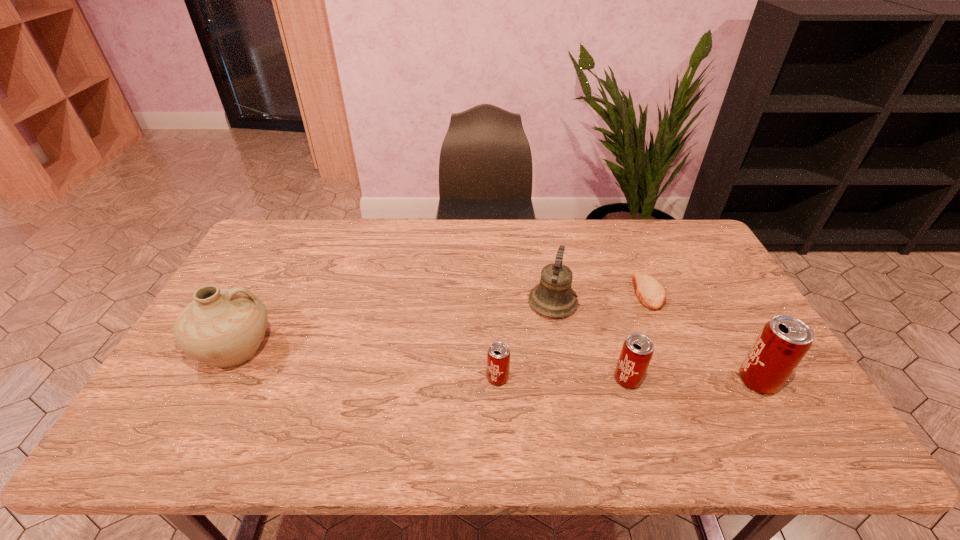
I want to click on free space located 0.060m on the left of the second object from left to right, so click(x=464, y=378).

The width and height of the screenshot is (960, 540). I want to click on free space located 0.330m on the back of the second beer can from right to left, so click(598, 284).

At what (x,y) coordinates should I click in order to perform the action: click on free point located on the left of the rightmost object. Please return your answer as a coordinate pair (x, y). This screenshot has width=960, height=540. Looking at the image, I should click on (708, 381).

Where is `vacant space situated on the back of the leftmost object`? vacant space situated on the back of the leftmost object is located at coordinates (283, 259).

At what (x,y) coordinates should I click in order to perform the action: click on blank space located on the back of the pita bread. Please return your answer as a coordinate pair (x, y). Image resolution: width=960 pixels, height=540 pixels. Looking at the image, I should click on (625, 236).

Where is `vacant region located on the left of the bell`? vacant region located on the left of the bell is located at coordinates (488, 303).

Find the location of a particular element. The height and width of the screenshot is (540, 960). object located at the left edge is located at coordinates (222, 327).

Identify the location of object at the right edge. (783, 342).

The height and width of the screenshot is (540, 960). Find the location of `object located at the near right corner`. object located at the near right corner is located at coordinates (783, 342).

The image size is (960, 540). In the image, there is a desktop. What are the coordinates of `vacant space at the far edge` in the screenshot? It's located at (353, 221).